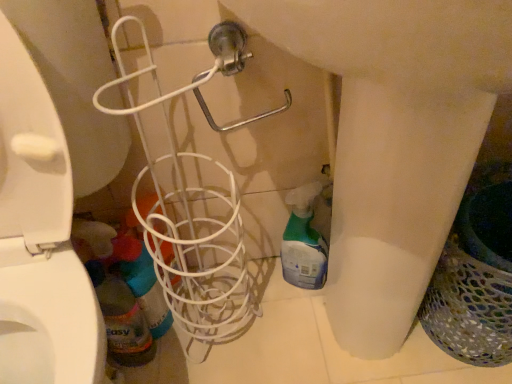
Question: Is translucent plastic spray bottle at lower center, arranged as the 2th cleaning product when viewed from the left, smaller than translucent plastic bottle at lower left?

Choices:
 (A) yes
 (B) no

Answer: (B)

Question: Considering the relative sizes of translucent plastic spray bottle at lower center, which is the first cleaning product from right to left, and translucent plastic bottle at lower left in the image provided, is translucent plastic spray bottle at lower center, which is the first cleaning product from right to left, taller than translucent plastic bottle at lower left?

Choices:
 (A) no
 (B) yes

Answer: (A)

Question: Is translucent plastic spray bottle at lower center, arranged as the 2th cleaning product when viewed from the left, positioned in front of translucent plastic bottle at lower left?

Choices:
 (A) yes
 (B) no

Answer: (B)

Question: Considering the relative sizes of translucent plastic spray bottle at lower center, arranged as the 2th cleaning product when viewed from the left, and translucent plastic bottle at lower left in the image provided, is translucent plastic spray bottle at lower center, arranged as the 2th cleaning product when viewed from the left, wider than translucent plastic bottle at lower left?

Choices:
 (A) yes
 (B) no

Answer: (A)

Question: Considering the relative sizes of translucent plastic spray bottle at lower center, arranged as the 2th cleaning product when viewed from the left, and translucent plastic bottle at lower left in the image provided, is translucent plastic spray bottle at lower center, arranged as the 2th cleaning product when viewed from the left, bigger than translucent plastic bottle at lower left?

Choices:
 (A) no
 (B) yes

Answer: (B)

Question: Can you confirm if translucent plastic spray bottle at lower center, which is the first cleaning product from right to left, is thinner than translucent plastic bottle at lower left?

Choices:
 (A) no
 (B) yes

Answer: (A)

Question: Is translucent plastic spray bottle at lower left, the 1th cleaning product in the left-to-right sequence, smaller than translucent plastic spray bottle at lower center, arranged as the 2th cleaning product when viewed from the left?

Choices:
 (A) yes
 (B) no

Answer: (A)

Question: Can you confirm if translucent plastic spray bottle at lower left, the 2th cleaning product when ordered from right to left, is shorter than translucent plastic spray bottle at lower center, arranged as the 2th cleaning product when viewed from the left?

Choices:
 (A) yes
 (B) no

Answer: (A)

Question: Considering the relative sizes of translucent plastic spray bottle at lower left, the 1th cleaning product in the left-to-right sequence, and translucent plastic spray bottle at lower center, which is the first cleaning product from right to left, in the image provided, is translucent plastic spray bottle at lower left, the 1th cleaning product in the left-to-right sequence, thinner than translucent plastic spray bottle at lower center, which is the first cleaning product from right to left,?

Choices:
 (A) yes
 (B) no

Answer: (B)

Question: Is translucent plastic spray bottle at lower left, the 1th cleaning product in the left-to-right sequence, bigger than translucent plastic spray bottle at lower center, which is the first cleaning product from right to left?

Choices:
 (A) yes
 (B) no

Answer: (B)

Question: Can we say translucent plastic spray bottle at lower left, the 1th cleaning product in the left-to-right sequence, lies outside translucent plastic spray bottle at lower center, arranged as the 2th cleaning product when viewed from the left?

Choices:
 (A) no
 (B) yes

Answer: (B)

Question: Is translucent plastic spray bottle at lower left, the 1th cleaning product in the left-to-right sequence, to the right of translucent plastic spray bottle at lower center, arranged as the 2th cleaning product when viewed from the left, from the viewer's perspective?

Choices:
 (A) no
 (B) yes

Answer: (A)

Question: Does translucent plastic spray bottle at lower left, the 2th cleaning product when ordered from right to left, have a lesser width compared to white wire basket at center?

Choices:
 (A) no
 (B) yes

Answer: (B)